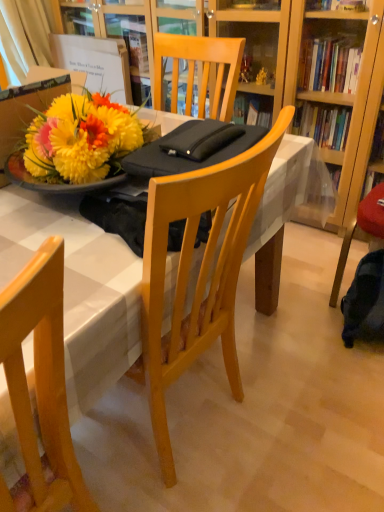
Question: Is point (163, 131) positioned closer to the camera than point (26, 406)?

Choices:
 (A) farther
 (B) closer

Answer: (A)

Question: Considering the positions of white glossy table at center and light wood chair at lower left in the image, is white glossy table at center taller or shorter than light wood chair at lower left?

Choices:
 (A) tall
 (B) short

Answer: (A)

Question: Which is farther from the light wood chair at lower left?

Choices:
 (A) white fabric curtain at upper left
 (B) white glossy table at center

Answer: (A)

Question: Which of these objects is positioned farthest from the white glossy table at center?

Choices:
 (A) white fabric curtain at upper left
 (B) light wood chair at lower left

Answer: (A)